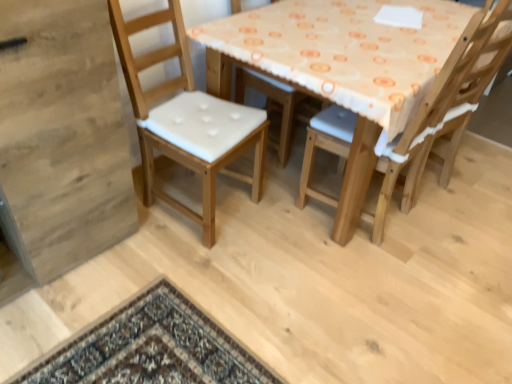
Question: Can you confirm if light brown wood chair at left, acting as the second chair starting from the right, is taller than wooden chair with white cushion at center, acting as the 2th chair starting from the left?

Choices:
 (A) yes
 (B) no

Answer: (B)

Question: Can you confirm if light brown wood chair at left, acting as the second chair starting from the right, is positioned to the right of wooden chair with white cushion at center, acting as the 2th chair starting from the left?

Choices:
 (A) yes
 (B) no

Answer: (B)

Question: From a real-world perspective, is light brown wood chair at left, the first chair when ordered from left to right, positioned over wooden chair with white cushion at center, which is counted as the first chair, starting from the right, based on gravity?

Choices:
 (A) yes
 (B) no

Answer: (B)

Question: Is light brown wood chair at left, the first chair when ordered from left to right, with wooden chair with white cushion at center, acting as the 2th chair starting from the left?

Choices:
 (A) no
 (B) yes

Answer: (A)

Question: From a real-world perspective, is light brown wood chair at left, acting as the second chair starting from the right, physically below wooden chair with white cushion at center, which is counted as the first chair, starting from the right?

Choices:
 (A) no
 (B) yes

Answer: (B)

Question: Does light brown wood chair at left, the first chair when ordered from left to right, contain wooden chair with white cushion at center, acting as the 2th chair starting from the left?

Choices:
 (A) no
 (B) yes

Answer: (A)

Question: Is wooden chair with white cushion at center, acting as the 2th chair starting from the left, shorter than light brown wood chair at left, the first chair when ordered from left to right?

Choices:
 (A) yes
 (B) no

Answer: (B)

Question: Is wooden chair with white cushion at center, acting as the 2th chair starting from the left, located outside light brown wood chair at left, the first chair when ordered from left to right?

Choices:
 (A) yes
 (B) no

Answer: (A)

Question: Can you confirm if wooden chair with white cushion at center, which is counted as the first chair, starting from the right, is bigger than light brown wood chair at left, acting as the second chair starting from the right?

Choices:
 (A) yes
 (B) no

Answer: (B)

Question: Is wooden chair with white cushion at center, acting as the 2th chair starting from the left, thinner than light brown wood chair at left, the first chair when ordered from left to right?

Choices:
 (A) no
 (B) yes

Answer: (A)

Question: From a real-world perspective, is wooden chair with white cushion at center, which is counted as the first chair, starting from the right, below light brown wood chair at left, the first chair when ordered from left to right?

Choices:
 (A) no
 (B) yes

Answer: (A)

Question: Does wooden chair with white cushion at center, acting as the 2th chair starting from the left, appear on the right side of light brown wood chair at left, acting as the second chair starting from the right?

Choices:
 (A) yes
 (B) no

Answer: (A)

Question: From the image's perspective, relative to wooden chair with white cushion at center, acting as the 2th chair starting from the left, is light brown wood chair at left, acting as the second chair starting from the right, above or below?

Choices:
 (A) below
 (B) above

Answer: (B)